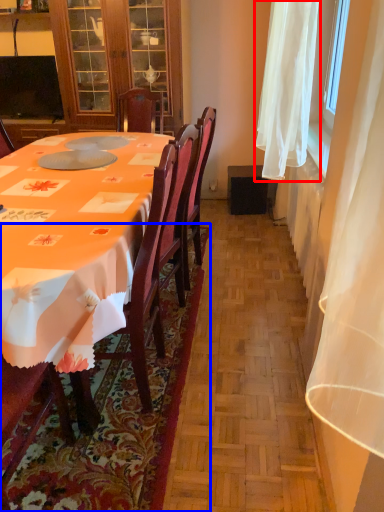
Question: Which object is closer to the camera taking this photo, curtain (highlighted by a red box) or mat (highlighted by a blue box)?

Choices:
 (A) curtain
 (B) mat

Answer: (B)